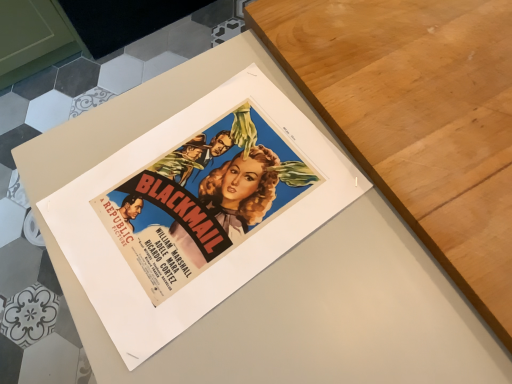
Question: Can you confirm if wooden table at upper right is wider than matte paper poster at center?

Choices:
 (A) yes
 (B) no

Answer: (B)

Question: Does wooden table at upper right have a lesser width compared to matte paper poster at center?

Choices:
 (A) yes
 (B) no

Answer: (A)

Question: Considering the relative positions of wooden table at upper right and matte paper poster at center in the image provided, is wooden table at upper right to the left of matte paper poster at center from the viewer's perspective?

Choices:
 (A) yes
 (B) no

Answer: (A)

Question: Would you say matte paper poster at center is part of wooden table at upper right's contents?

Choices:
 (A) no
 (B) yes

Answer: (A)

Question: Is wooden table at upper right taller than matte paper poster at center?

Choices:
 (A) no
 (B) yes

Answer: (A)

Question: Is wooden table at upper right at the right side of matte paper poster at center?

Choices:
 (A) yes
 (B) no

Answer: (B)

Question: Does matte paper poster at center lie behind wooden table at upper right?

Choices:
 (A) yes
 (B) no

Answer: (B)

Question: Does matte paper poster at center have a smaller size compared to wooden table at upper right?

Choices:
 (A) no
 (B) yes

Answer: (A)

Question: From a real-world perspective, is matte paper poster at center physically above wooden table at upper right?

Choices:
 (A) no
 (B) yes

Answer: (A)

Question: From the image's perspective, is matte paper poster at center above wooden table at upper right?

Choices:
 (A) no
 (B) yes

Answer: (A)

Question: Is matte paper poster at center wider than wooden table at upper right?

Choices:
 (A) no
 (B) yes

Answer: (B)

Question: Is matte paper poster at center at the right side of wooden table at upper right?

Choices:
 (A) yes
 (B) no

Answer: (A)

Question: In terms of width, does wooden table at upper right look wider or thinner when compared to matte paper poster at center?

Choices:
 (A) wide
 (B) thin

Answer: (B)